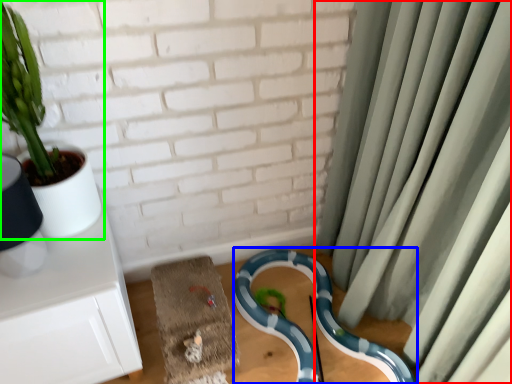
Question: Considering the real-world distances, which object is farthest from curtain (highlighted by a red box)? snake (highlighted by a blue box) or houseplant (highlighted by a green box)?

Choices:
 (A) snake
 (B) houseplant

Answer: (B)